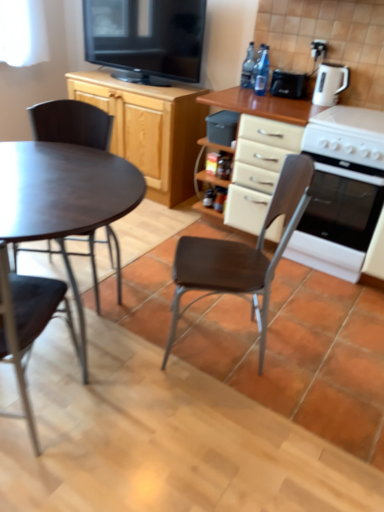
Image resolution: width=384 pixels, height=512 pixels. I want to click on vacant space to the left of white glossy electric kettle at upper right, so click(297, 101).